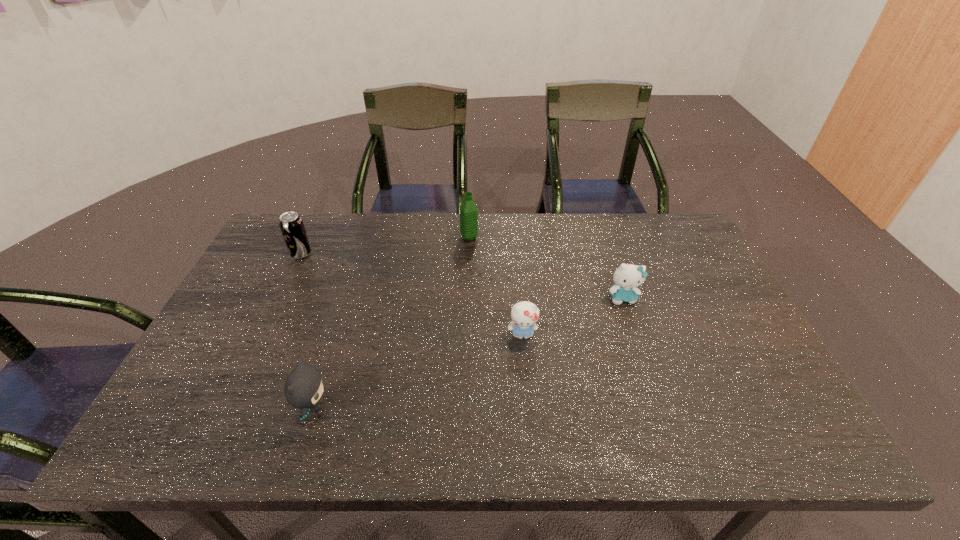
Where is `vacant space that satisfies the following two spatial constraints: 1. on the front-facing side of the second kitten from right to left; 2. on the front-facing side of the second object from left to right`? vacant space that satisfies the following two spatial constraints: 1. on the front-facing side of the second kitten from right to left; 2. on the front-facing side of the second object from left to right is located at coordinates (529, 409).

The height and width of the screenshot is (540, 960). What are the coordinates of `free space in the image that satisfies the following two spatial constraints: 1. on the face of the rightmost object; 2. on the front-facing side of the nearest kitten` in the screenshot? It's located at (660, 409).

At what (x,y) coordinates should I click in order to perform the action: click on free space in the image that satisfies the following two spatial constraints: 1. on the face of the rightmost kitten; 2. on the front-facing side of the second object from left to right. Please return your answer as a coordinate pair (x, y). Looking at the image, I should click on (660, 409).

The image size is (960, 540). What are the coordinates of `free space that satisfies the following two spatial constraints: 1. on the face of the third farthest object; 2. on the front-facing side of the second object from left to right` in the screenshot? It's located at (660, 409).